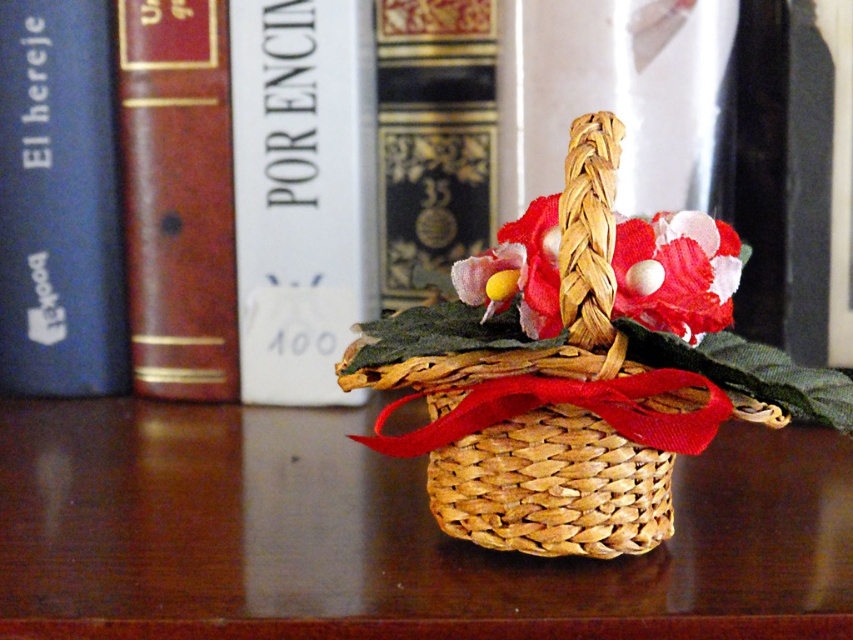
You are standing in front of the basket and books. There are two points marked in the image. The first point is at coordinate point (807,588) and the second is at point (529,497). Which point is closer to you?

Point (807,588) is in front of point (529,497), so it is closer to you.

You are organizing a gift basket and need to place a gift card on the white paper at upper center and the gold embossed book at center. The gift card is 4 inches long. Will it fit between them?

The distance between the white paper at upper center and the gold embossed book at center is 4.07 inches, so the 4 inch long gift card will fit between them.

You are organizing a picnic and have both the woven wood basket at center and the woven straw basket at center. If you want to carry more items, which basket should you choose?

The woven wood basket at center is larger in size than the woven straw basket at center, so you should choose the woven wood basket at center to carry more items.